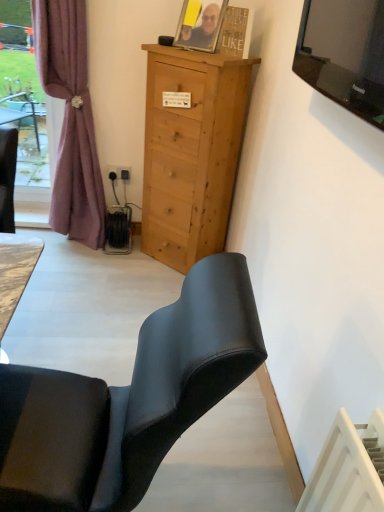
What is the approximate width of matte black chair at lower left?

29.48 inches.

Describe the element at coordinates (202, 29) in the screenshot. This screenshot has width=384, height=512. I see `matte black photo frame at upper center` at that location.

This screenshot has width=384, height=512. What do you see at coordinates (191, 152) in the screenshot?
I see `light brown wood cabinet at center` at bounding box center [191, 152].

This screenshot has width=384, height=512. What are the coordinates of `matte black chair at lower left` in the screenshot? It's located at (128, 400).

Is light brown wood cabinet at center aimed at black plastic power outlet at lower left?

No, light brown wood cabinet at center is not aimed at black plastic power outlet at lower left.

Based on the photo, between light brown wood cabinet at center and black plastic power outlet at lower left, which one is positioned in front?

light brown wood cabinet at center is in front.

Which of these two, light brown wood cabinet at center or black plastic power outlet at lower left, stands taller?

Standing taller between the two is light brown wood cabinet at center.

Is point (52, 477) positioned in front of point (226, 146)?

Yes, it is in front of point (226, 146).

From the picture: Does matte black chair at lower left have a larger size compared to light brown wood cabinet at center?

Correct, matte black chair at lower left is larger in size than light brown wood cabinet at center.

Based on their positions, is matte black chair at lower left located to the left or right of light brown wood cabinet at center?

matte black chair at lower left is positioned on light brown wood cabinet at center's left side.

From a real-world perspective, is matte black chair at lower left physically above light brown wood cabinet at center?

No.

How far apart are black plastic power outlet at lower left and light brown wood cabinet at center?

black plastic power outlet at lower left and light brown wood cabinet at center are 24.71 inches apart.

Is light brown wood cabinet at center a part of black plastic power outlet at lower left?

No.

Considering the sizes of objects black plastic power outlet at lower left and light brown wood cabinet at center in the image provided, who is wider, black plastic power outlet at lower left or light brown wood cabinet at center?

Wider between the two is light brown wood cabinet at center.

From the image's perspective, is black plastic power outlet at lower left located above or below light brown wood cabinet at center?

From the image's perspective, black plastic power outlet at lower left appears above light brown wood cabinet at center.

Based on the photo, measure the distance between matte black photo frame at upper center and mauve fabric curtain at left.

matte black photo frame at upper center and mauve fabric curtain at left are 33.07 inches apart from each other.

Is point (210, 45) positioned before point (85, 190)?

Yes.

Can you confirm if matte black photo frame at upper center is positioned to the right of mauve fabric curtain at left?

Indeed, matte black photo frame at upper center is positioned on the right side of mauve fabric curtain at left.

Would you say mauve fabric curtain at left is to the left or to the right of light brown wood cabinet at center in the picture?

Clearly, mauve fabric curtain at left is on the left of light brown wood cabinet at center in the image.

From the picture: Which is in front, mauve fabric curtain at left or light brown wood cabinet at center?

light brown wood cabinet at center.

Which point is more forward, (x=60, y=149) or (x=184, y=83)?

Positioned in front is point (x=184, y=83).

From the image's perspective, which is above, matte black photo frame at upper center or light brown wood cabinet at center?

matte black photo frame at upper center.

Can you see matte black photo frame at upper center touching light brown wood cabinet at center?

matte black photo frame at upper center and light brown wood cabinet at center are clearly separated.

Image resolution: width=384 pixels, height=512 pixels. What are the coordinates of `person on the right of light brown wood cabinet at center` in the screenshot? It's located at (202, 29).

Is matte black photo frame at upper center situated inside light brown wood cabinet at center or outside?

matte black photo frame at upper center is not inside light brown wood cabinet at center, it's outside.

Is mauve fabric curtain at left far from black plastic power outlet at lower left?

Actually, mauve fabric curtain at left and black plastic power outlet at lower left are a little close together.

Image resolution: width=384 pixels, height=512 pixels. I want to click on power outlet located underneath the mauve fabric curtain at left (from a real-world perspective), so click(120, 170).

Who is smaller, mauve fabric curtain at left or black plastic power outlet at lower left?

With smaller size is black plastic power outlet at lower left.

From the image's perspective, would you say mauve fabric curtain at left is positioned over black plastic power outlet at lower left?

Yes, from the image's perspective, mauve fabric curtain at left is over black plastic power outlet at lower left.

Image resolution: width=384 pixels, height=512 pixels. Find the location of `cabinetry to the right of black plastic power outlet at lower left`. cabinetry to the right of black plastic power outlet at lower left is located at coordinates (191, 152).

This screenshot has height=512, width=384. I want to click on cabinetry above the matte black chair at lower left (from the image's perspective), so click(191, 152).

From the picture: Looking at the image, which one is located closer to mauve fabric curtain at left, matte black chair at lower left or light brown wood cabinet at center?

The object closer to mauve fabric curtain at left is light brown wood cabinet at center.

Considering their positions, is light brown wood cabinet at center positioned closer to matte black photo frame at upper center than mauve fabric curtain at left?

The object closer to matte black photo frame at upper center is light brown wood cabinet at center.

When comparing their distances from matte black photo frame at upper center, does black plastic power outlet at lower left or light brown wood cabinet at center seem closer?

light brown wood cabinet at center is positioned closer to the anchor matte black photo frame at upper center.

Which object lies further to the anchor point light brown wood cabinet at center, black plastic power outlet at lower left or matte black photo frame at upper center?

black plastic power outlet at lower left is further to light brown wood cabinet at center.

In the scene shown: When comparing their distances from black plastic power outlet at lower left, does mauve fabric curtain at left or matte black chair at lower left seem further?

The object further to black plastic power outlet at lower left is matte black chair at lower left.

Based on their spatial positions, is light brown wood cabinet at center or matte black chair at lower left further from matte black photo frame at upper center?

matte black chair at lower left lies further to matte black photo frame at upper center than the other object.

Which object lies nearer to the anchor point matte black chair at lower left, light brown wood cabinet at center or matte black photo frame at upper center?

light brown wood cabinet at center.

From the image, which object appears to be farther from black plastic power outlet at lower left, matte black photo frame at upper center or light brown wood cabinet at center?

matte black photo frame at upper center lies further to black plastic power outlet at lower left than the other object.

You are a GUI agent. You are given a task and a screenshot of the screen. Output one action in this format:
    pyautogui.click(x=<x>, y=<y>)
    Task: Click on the person located between light brown wood cabinet at center and black plastic power outlet at lower left in the depth direction
    
    Given the screenshot: What is the action you would take?
    pyautogui.click(x=202, y=29)

I want to click on cabinetry between matte black chair at lower left and mauve fabric curtain at left from front to back, so [191, 152].

At what (x,y) coordinates should I click in order to perform the action: click on person between matte black chair at lower left and black plastic power outlet at lower left along the z-axis. Please return your answer as a coordinate pair (x, y). Looking at the image, I should click on (202, 29).

Find the location of a particular element. cabinetry between matte black chair at lower left and black plastic power outlet at lower left in the front-back direction is located at coordinates (191, 152).